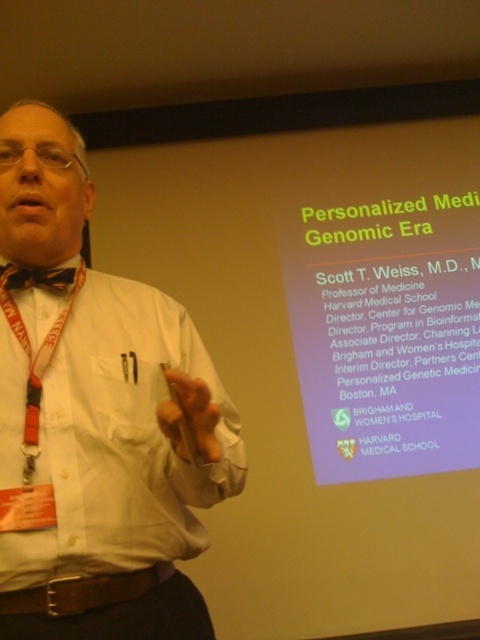
You are attending a presentation and notice two bow ties on the speaker. Which one is closer to you, the matte black bow tie at left or the brown textured bow tie at center?

The matte black bow tie at left is closer to the viewer than the brown textured bow tie at center.